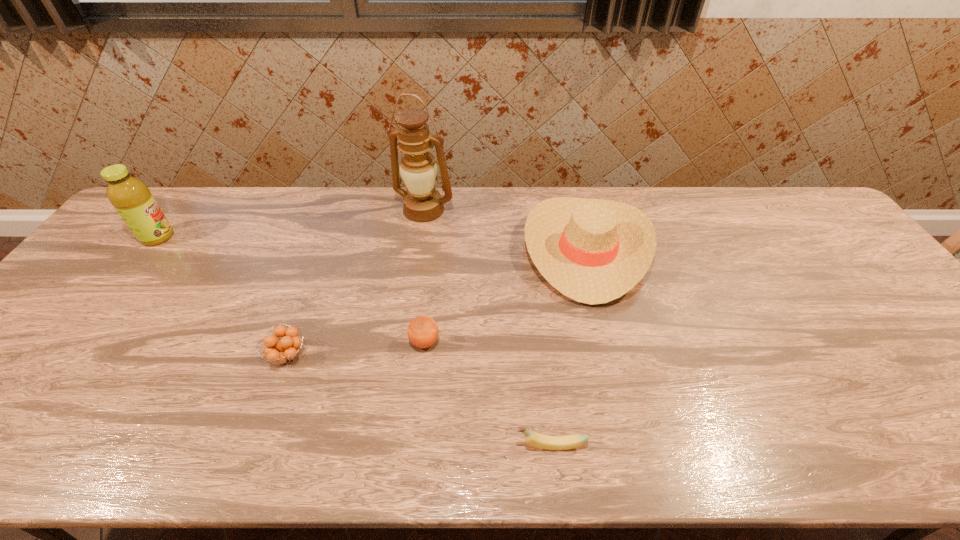
This screenshot has width=960, height=540. I want to click on oil lamp, so pyautogui.click(x=422, y=202).

The image size is (960, 540). What are the coordinates of `the fifth shortest object` in the screenshot? It's located at [x=132, y=199].

You are a GUI agent. You are given a task and a screenshot of the screen. Output one action in this format:
    pyautogui.click(x=<x>, y=<y>)
    Task: Click on the fruit juice
    Image resolution: width=960 pixels, height=540 pixels.
    Given the screenshot: What is the action you would take?
    pyautogui.click(x=132, y=199)

This screenshot has width=960, height=540. Find the location of `sunhat`. sunhat is located at coordinates coord(594,251).

Locate an element on the screen. This screenshot has height=540, width=960. the right orange fruit is located at coordinates (422, 332).

Identify the location of the left orange fruit. (285, 350).

In order to click on banana in this screenshot , I will do `click(537, 440)`.

Image resolution: width=960 pixels, height=540 pixels. In order to click on free space located 0.310m on the front of the oil lamp in this screenshot , I will do `click(412, 295)`.

Identify the location of vacant space positioned 0.190m on the front label of the leftmost object. The width and height of the screenshot is (960, 540). (235, 237).

This screenshot has height=540, width=960. I want to click on free location located 0.110m on the right of the sunhat, so click(x=686, y=250).